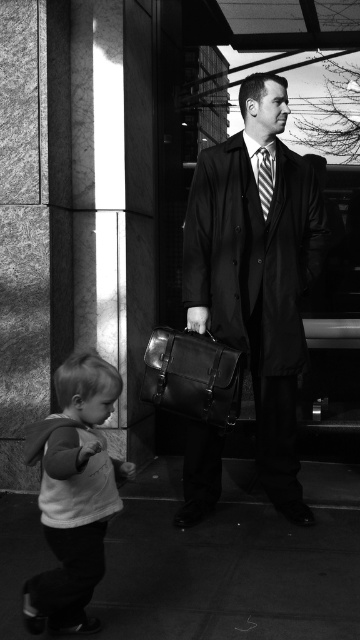
Question: Which is farther from the striped fabric tie at center?

Choices:
 (A) matte black coat at center
 (B) smooth concrete pavement at lower center
 (C) white soft shirt at lower left
 (D) leather briefcase at center

Answer: (B)

Question: Is smooth concrete pavement at lower center in front of striped fabric tie at center?

Choices:
 (A) yes
 (B) no

Answer: (A)

Question: Where is matte black coat at center located in relation to striped fabric tie at center in the image?

Choices:
 (A) left
 (B) right

Answer: (A)

Question: Which point is farther from the camera taking this photo?

Choices:
 (A) (227, 333)
 (B) (33, 614)
 (C) (257, 184)

Answer: (C)

Question: Does smooth concrete pavement at lower center appear on the left side of striped fabric tie at center?

Choices:
 (A) no
 (B) yes

Answer: (B)

Question: Considering the real-world distances, which object is farthest from the leather briefcase at center?

Choices:
 (A) white soft shirt at lower left
 (B) smooth concrete pavement at lower center

Answer: (B)